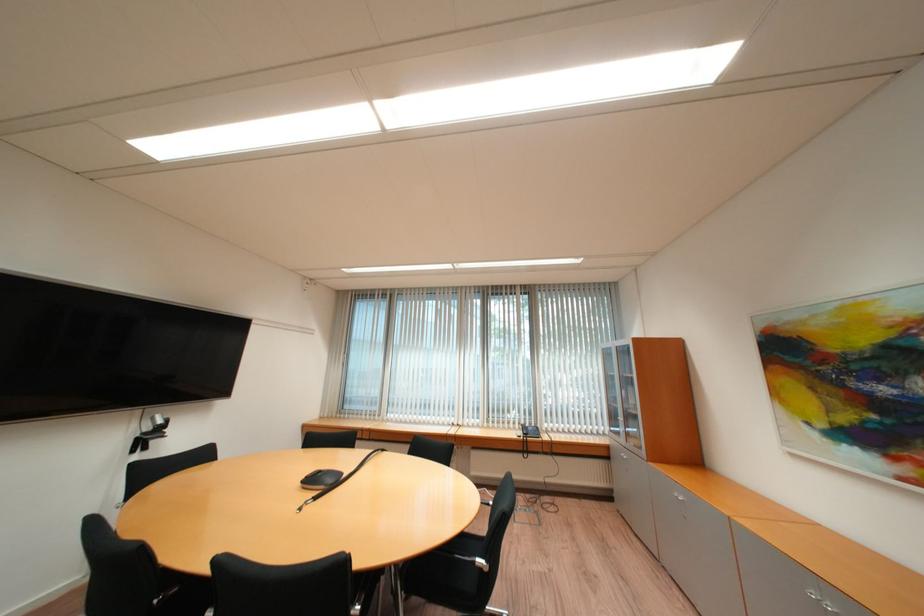
Where would you lift the black phone handset? Please return your answer as a coordinate pair (x, y).

(321, 479)